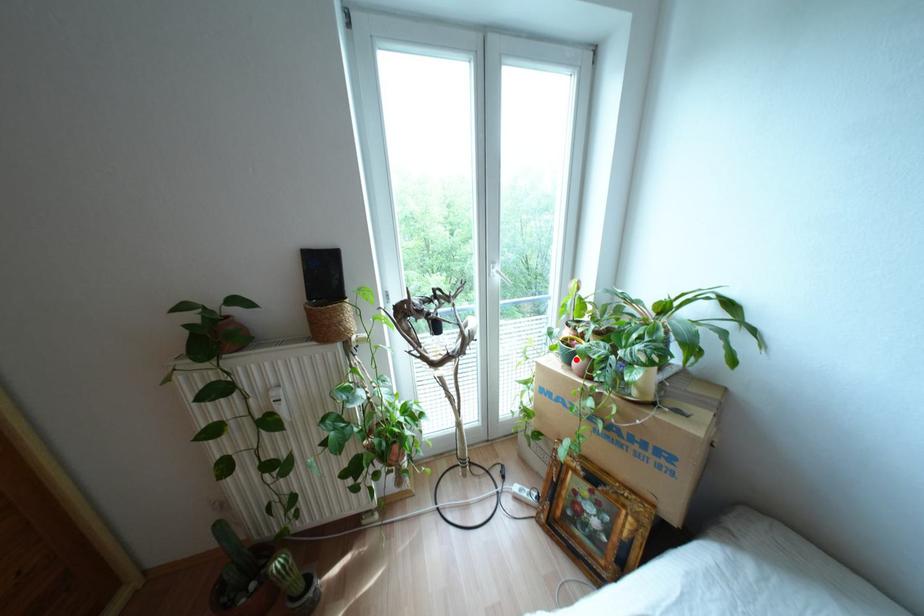
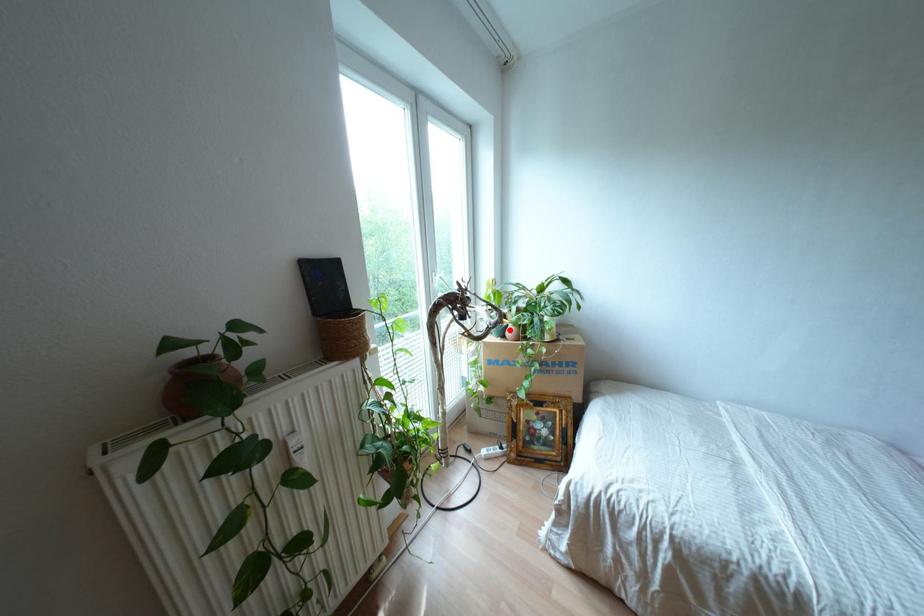
I am providing you with two images of the same scene from different viewpoints. A red point is marked on the first image and another point is marked on the second image. Does the point marked in image1 correspond to the same location as the one in image2?

Yes